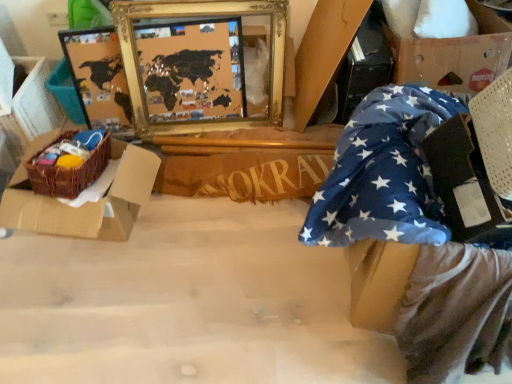
You are a GUI agent. You are given a task and a screenshot of the screen. Output one action in this format:
    pyautogui.click(x=<x>, y=<y>)
    Task: Click on the vacant space in between brown woven basket at left and wooden sign at center
    
    Given the screenshot: What is the action you would take?
    pyautogui.click(x=215, y=227)